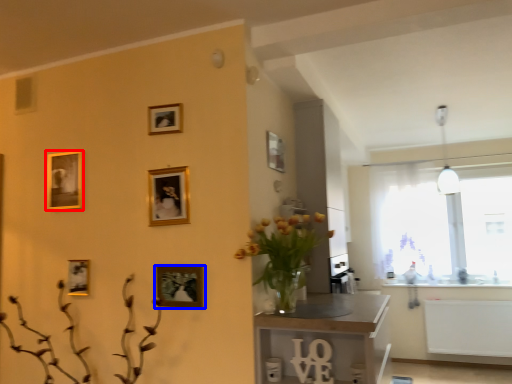
Question: Among these objects, which one is nearest to the camera, picture frame (highlighted by a red box) or picture frame (highlighted by a blue box)?

Choices:
 (A) picture frame
 (B) picture frame

Answer: (B)